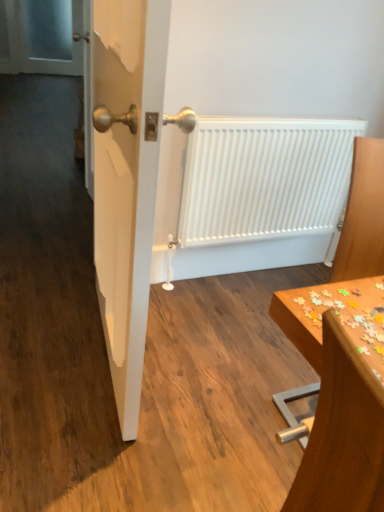
The width and height of the screenshot is (384, 512). Find the location of `free location to the left of white glossy door at center`. free location to the left of white glossy door at center is located at coordinates (47, 330).